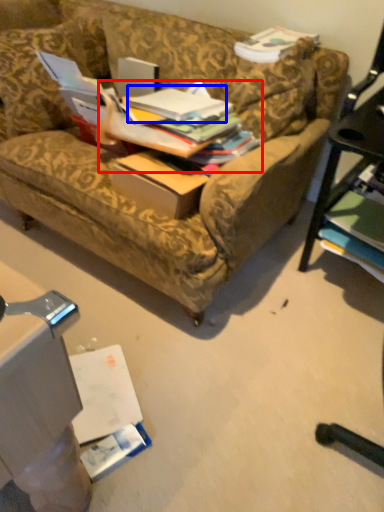
Question: Which point is further to the camera, book (highlighted by a red box) or book (highlighted by a blue box)?

Choices:
 (A) book
 (B) book

Answer: (B)